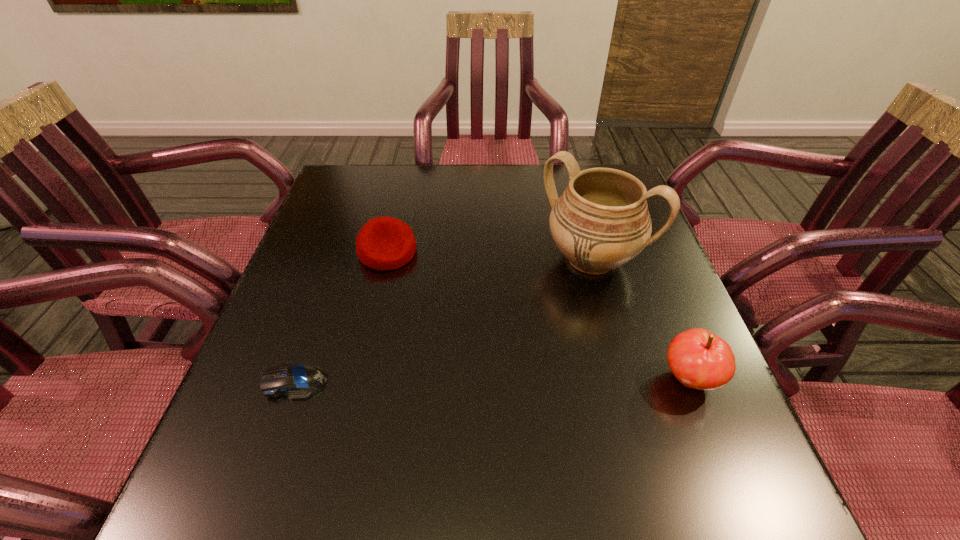
Where is `vacant point located 0.130m on the seat area of the second shortest object`? vacant point located 0.130m on the seat area of the second shortest object is located at coordinates (431, 300).

The height and width of the screenshot is (540, 960). What are the coordinates of `object situated at the near edge` in the screenshot? It's located at (699, 359).

Find the location of a particular element. computer mouse at the left edge is located at coordinates (296, 380).

In order to click on beanbag situated at the left edge in this screenshot , I will do click(384, 243).

This screenshot has width=960, height=540. In order to click on apple at the right edge in this screenshot , I will do `click(699, 359)`.

Locate an element on the screen. urn that is positioned at the right edge is located at coordinates pyautogui.click(x=601, y=221).

Where is `object that is positioned at the near right corner`? object that is positioned at the near right corner is located at coordinates (699, 359).

Identify the location of vacant space at the far edge of the desktop. (493, 186).

I want to click on vacant space at the left edge, so pos(319,306).

Image resolution: width=960 pixels, height=540 pixels. In order to click on vacant area at the right edge of the desktop in this screenshot , I will do `click(667, 327)`.